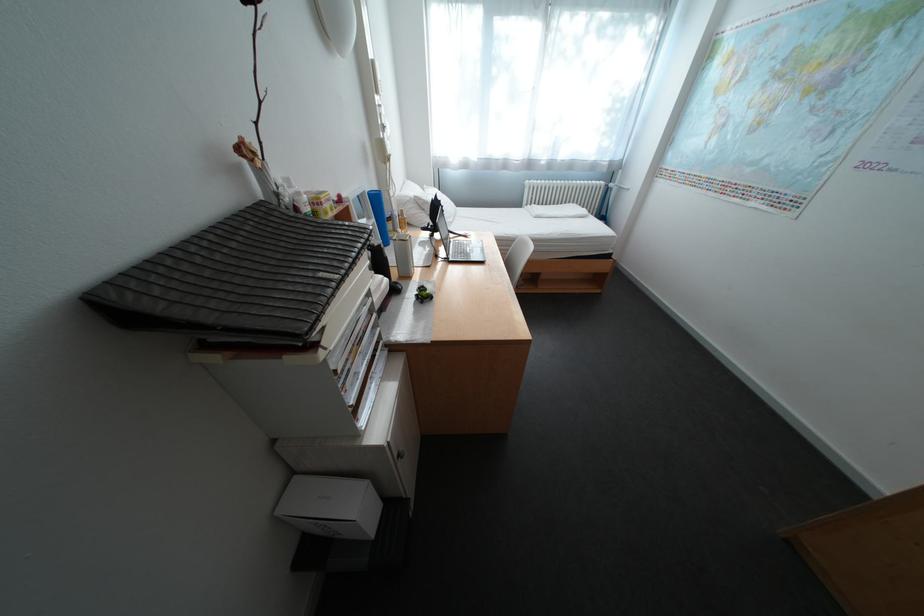
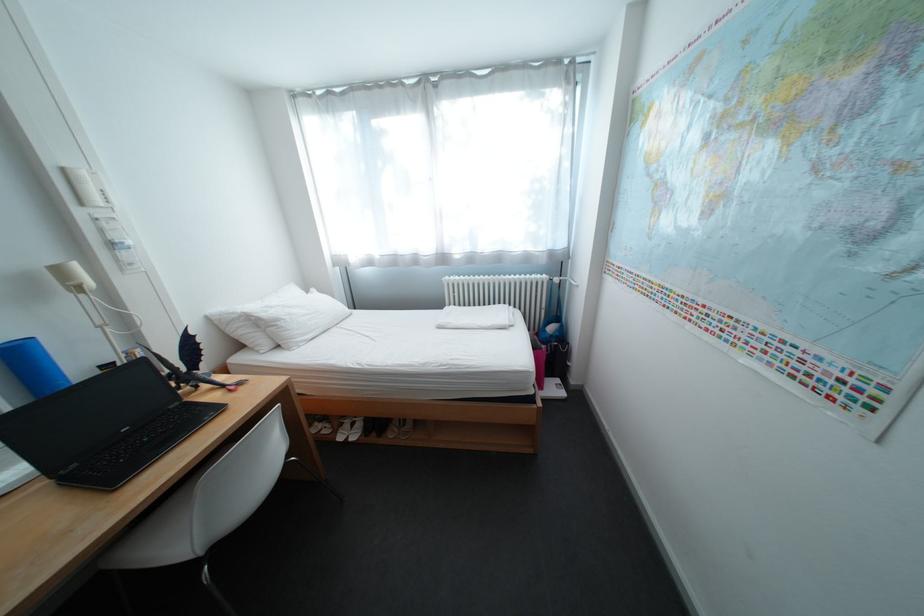
In the second image, find the point that corresponds to point 540,182 in the first image.

(459, 278)